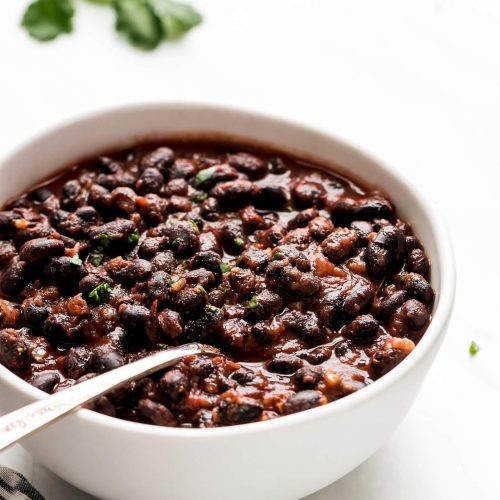
This screenshot has height=500, width=500. I want to click on white bowl, so pos(310,441).